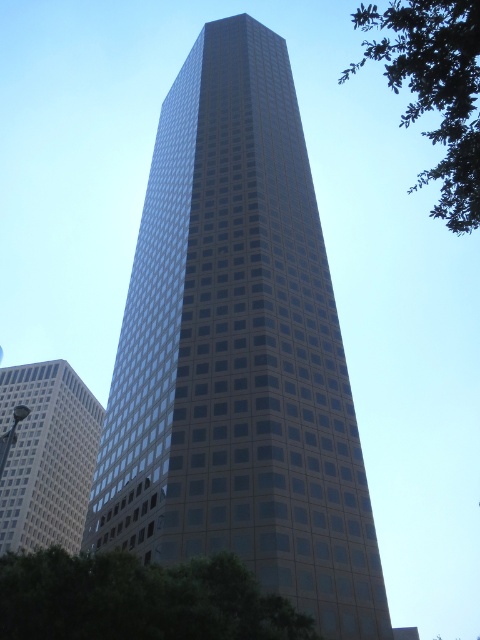
You are standing in the city square and see the glassy reflective skyscraper at center and the green leafy tree at lower left. Which object takes up more visual space in the image?

The glassy reflective skyscraper at center takes up more visual space in the image as it is bigger than the green leafy tree at lower left.

Consider the image. You are standing in an urban park and see the glassy reflective skyscraper at center. If you want to take a photo of it from a distance where it fills the frame without appearing too small, would 30 meters be a suitable distance?

The glassy reflective skyscraper at center is 31.45 meters from the viewer. Since 30 meters is slightly closer than the actual distance, positioning yourself at 30 meters would make the skyscraper appear slightly larger in the photo, potentially filling the frame more effectively than at 31.45 meters.